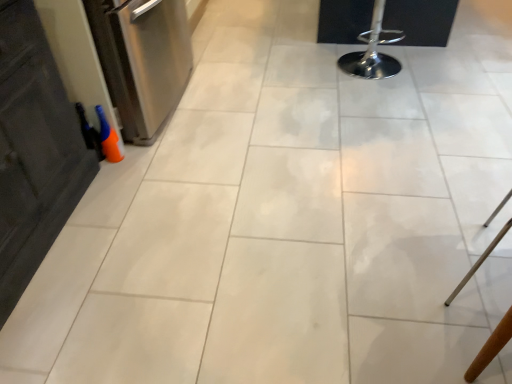
Identify the location of free space in front of polished chrome bar stool at upper right. (389, 97).